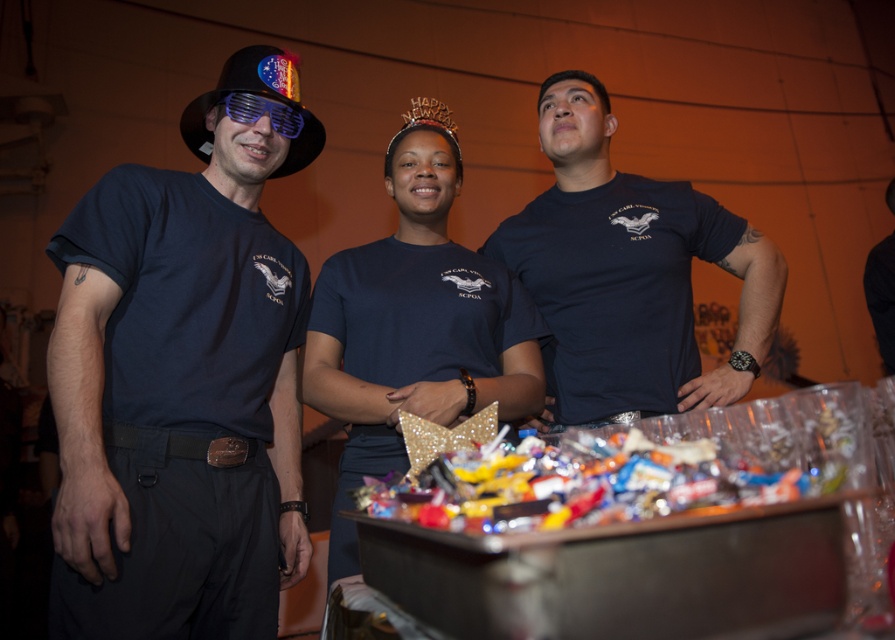
You are holding a small drone that can fly up to 2 meters away from you. You want to fly it to the point marked at coordinates point (671, 189) in the image. Can the drone reach that point without exceeding its maximum range?

The point marked at coordinates point (671, 189) is 1.63 meters away from you, so yes, the drone can reach that point since it is within its 2 meter maximum range.

You are at a party and want to place a drink on the glossy plastic tray at center without knocking over the black fabric party hat at upper left. Which side of the tray should you place the drink to keep it stable?

The glossy plastic tray at center is positioned on the right side of the black fabric party hat at upper left. To keep the drink stable, place it on the right side of the tray away from the hat.